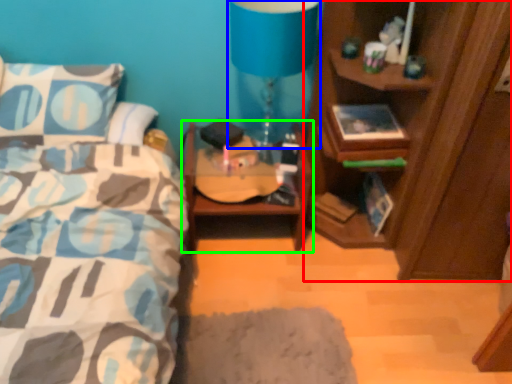
Question: Estimate the real-world distances between objects in this image. Which object is closer to cabinetry (highlighted by a red box), table lamp (highlighted by a blue box) or nightstand (highlighted by a green box)?

Choices:
 (A) table lamp
 (B) nightstand

Answer: (B)